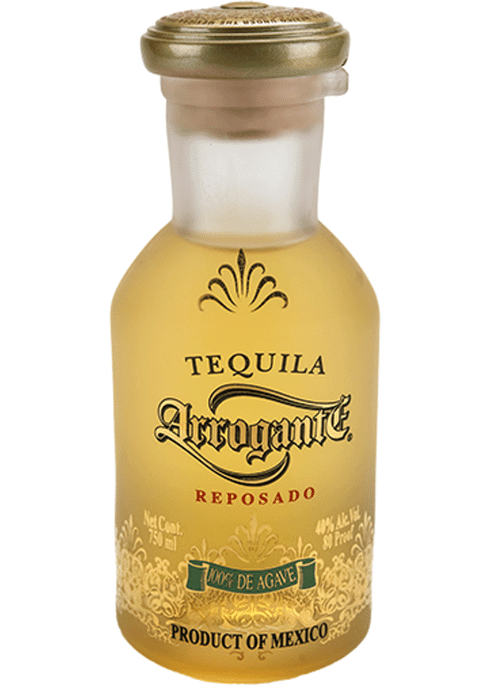
This screenshot has width=490, height=686. I want to click on glass bottle, so click(351, 472).